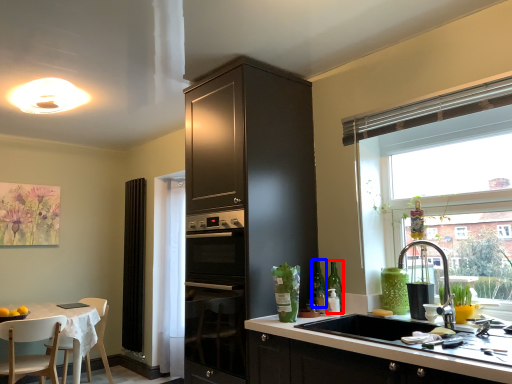
Question: Which object appears farthest to the camera in this image, bottle (highlighted by a red box) or bottle (highlighted by a blue box)?

Choices:
 (A) bottle
 (B) bottle

Answer: (B)